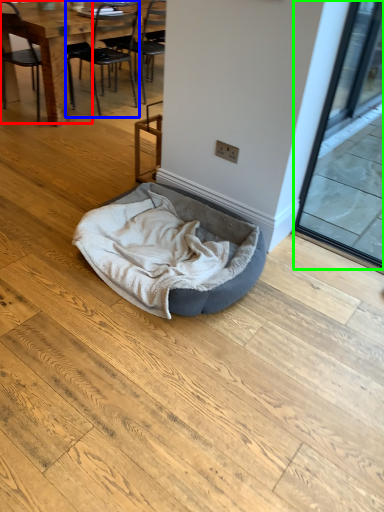
Question: Considering the real-world distances, which object is closest to chair (highlighted by a red box)? chair (highlighted by a blue box) or screen door (highlighted by a green box).

Choices:
 (A) chair
 (B) screen door

Answer: (A)